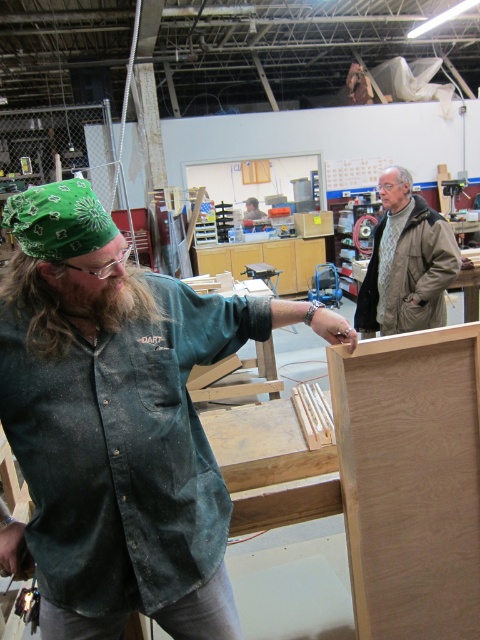
Is bare wood board at center behind gray wool sweater at upper right?

That is False.

Does point (360, 625) come behind point (416, 244)?

No, (360, 625) is closer to viewer.

Is point (372, 552) behind point (392, 198)?

That is False.

I want to click on bare wood board at center, so click(410, 481).

Which of these two, dark green corduroy shirt at left or bare wood board at center, stands taller?

bare wood board at center

Who is more distant from viewer, (x=151, y=452) or (x=477, y=380)?

The point (x=477, y=380) is behind.

This screenshot has height=640, width=480. Identify the location of dark green corduroy shirt at left. (x=122, y=449).

Is dark green corduroy shirt at left thinner than gray wool sweater at upper right?

In fact, dark green corduroy shirt at left might be wider than gray wool sweater at upper right.

Between dark green corduroy shirt at left and gray wool sweater at upper right, which one appears on the right side from the viewer's perspective?

gray wool sweater at upper right

Who is more distant from viewer, (146, 317) or (400, 257)?

The point (400, 257) is behind.

Where is `dark green corduroy shirt at left`? The image size is (480, 640). dark green corduroy shirt at left is located at coordinates (122, 449).